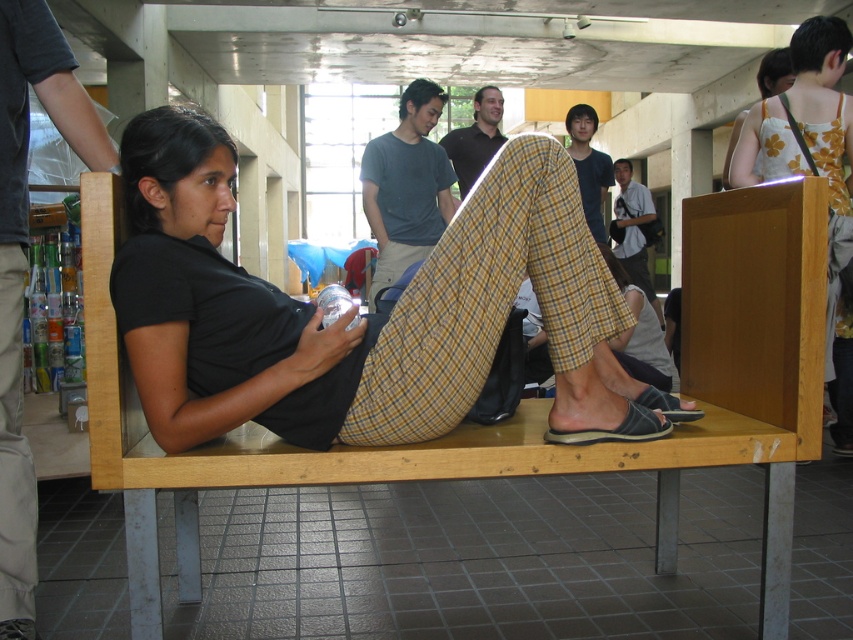
You are a photographer standing at the center of the scene. You want to take a photo of both the dark brown shirt at center and the black rubber sandal at lower right. Can you fit both objects in your camera frame if your camera has a maximum horizontal field of view of 2.5 meters?

The dark brown shirt at center is 3.03 meters away from the black rubber sandal at lower right. Since the distance between them exceeds the camera frame of 2.5 meters, you cannot fit both objects in the frame.